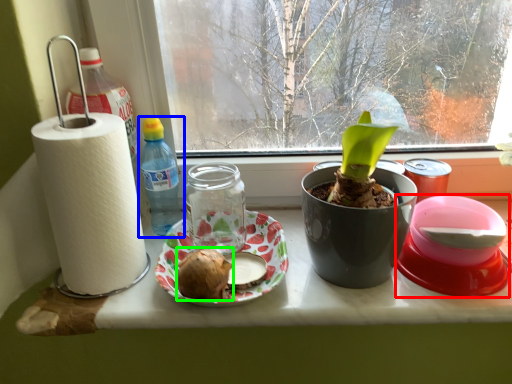
Question: Which is nearer to the appliance (highlighted by a red box)? bottle (highlighted by a blue box) or food (highlighted by a green box).

Choices:
 (A) bottle
 (B) food

Answer: (B)